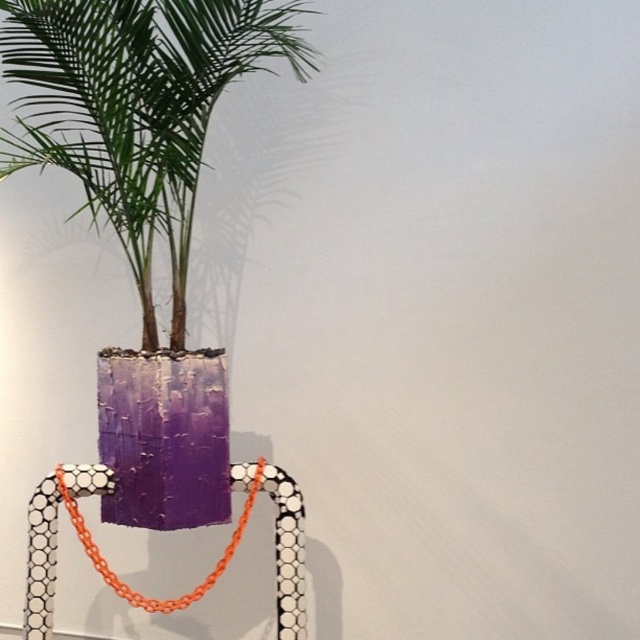
From the picture: Is purple textured planter at center closer to the viewer compared to orange plastic necklace at center?

Yes, it is.

From the picture: Does purple textured planter at center have a lesser height compared to orange plastic necklace at center?

In fact, purple textured planter at center may be taller than orange plastic necklace at center.

Which is in front, point (195, 145) or point (116, 579)?

Point (195, 145) is in front.

Locate an element on the screen. The width and height of the screenshot is (640, 640). purple textured planter at center is located at coordinates click(145, 205).